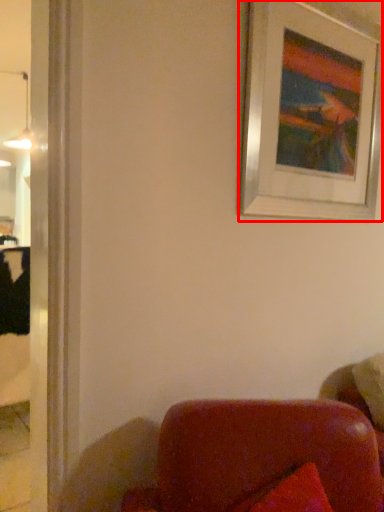
Question: From the image's perspective, where is picture frame (annotated by the red box) located relative to lamp?

Choices:
 (A) below
 (B) above

Answer: (A)